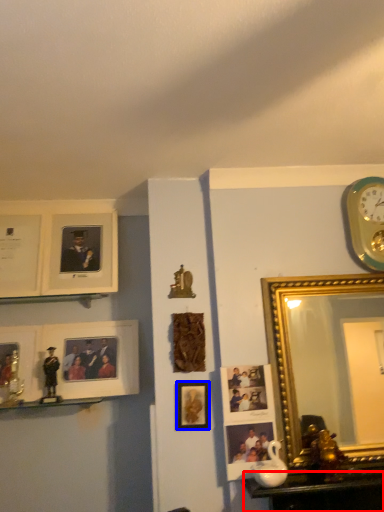
Question: Which object appears closest to the camera in this image, table (highlighted by a red box) or picture frame (highlighted by a blue box)?

Choices:
 (A) table
 (B) picture frame

Answer: (A)